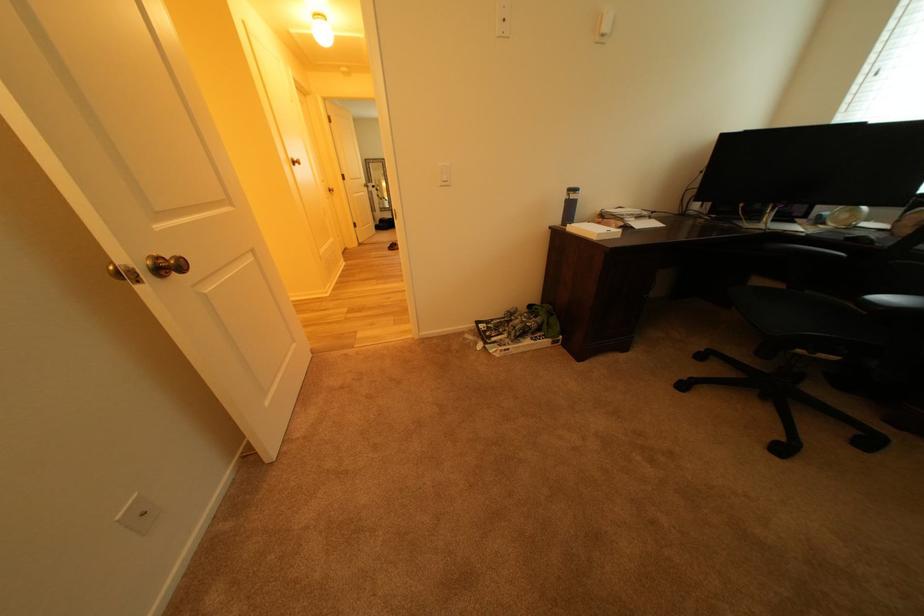
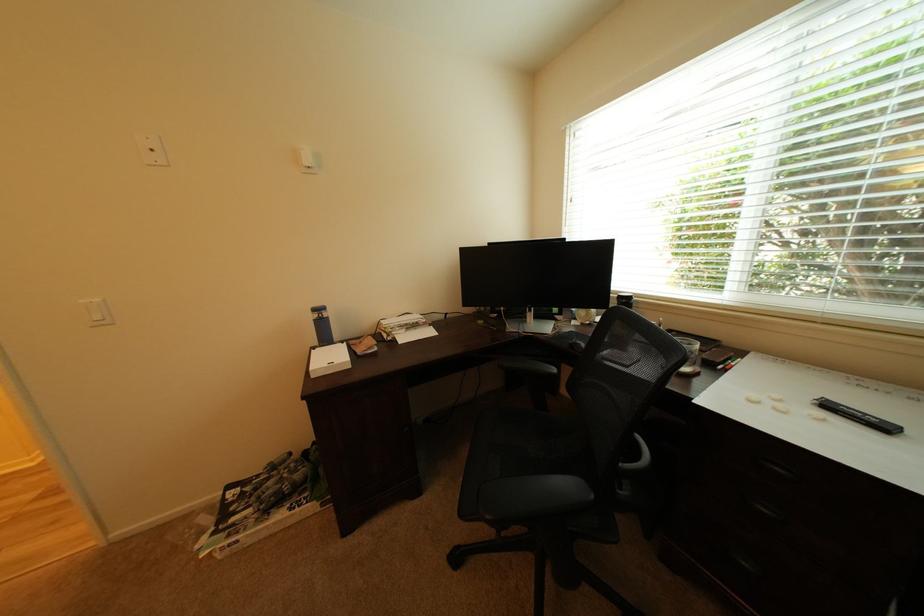
In the second image, find the point that corresponds to (518,351) in the first image.

(248, 543)